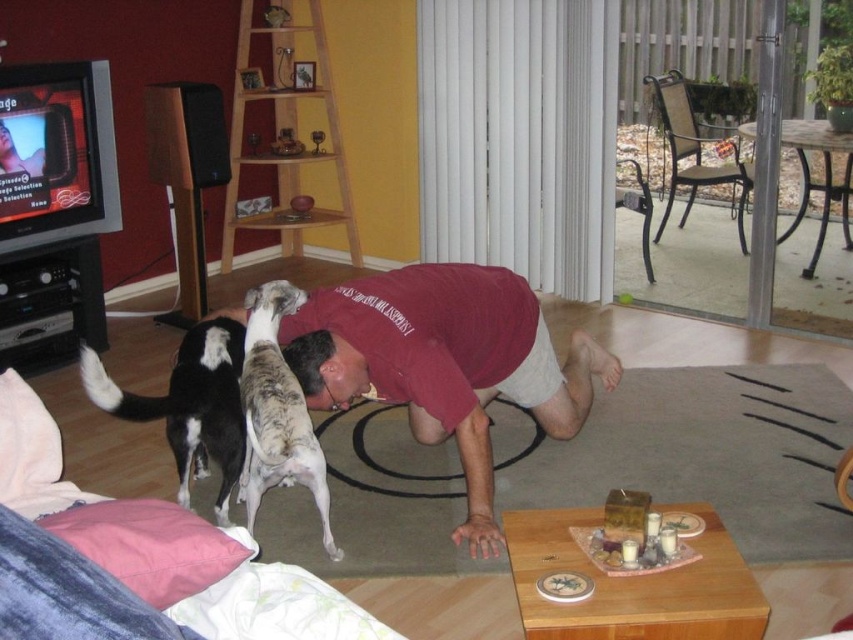
Can you confirm if maroon fabric squat at center is shorter than black and white fur at lower left?

No, maroon fabric squat at center is not shorter than black and white fur at lower left.

Does maroon fabric squat at center have a lesser width compared to black and white fur at lower left?

No, maroon fabric squat at center is not thinner than black and white fur at lower left.

Which is behind, point (308, 314) or point (196, 412)?

Positioned behind is point (308, 314).

Locate an element on the screen. The height and width of the screenshot is (640, 853). maroon fabric squat at center is located at coordinates (445, 362).

Is maroon fabric squat at center below speckled fur dog at center?

Yes, maroon fabric squat at center is below speckled fur dog at center.

Is point (469, 352) positioned after point (247, 454)?

Yes, point (469, 352) is farther from viewer.

Between point (463, 308) and point (250, 502), which one is positioned in front?

Positioned in front is point (250, 502).

The image size is (853, 640). What are the coordinates of `maroon fabric squat at center` in the screenshot? It's located at (445, 362).

Who is higher up, black and white fur at lower left or speckled fur dog at center?

Positioned higher is black and white fur at lower left.

Is point (189, 349) farther from viewer compared to point (263, 310)?

That is True.

Locate an element on the screen. black and white fur at lower left is located at coordinates (189, 404).